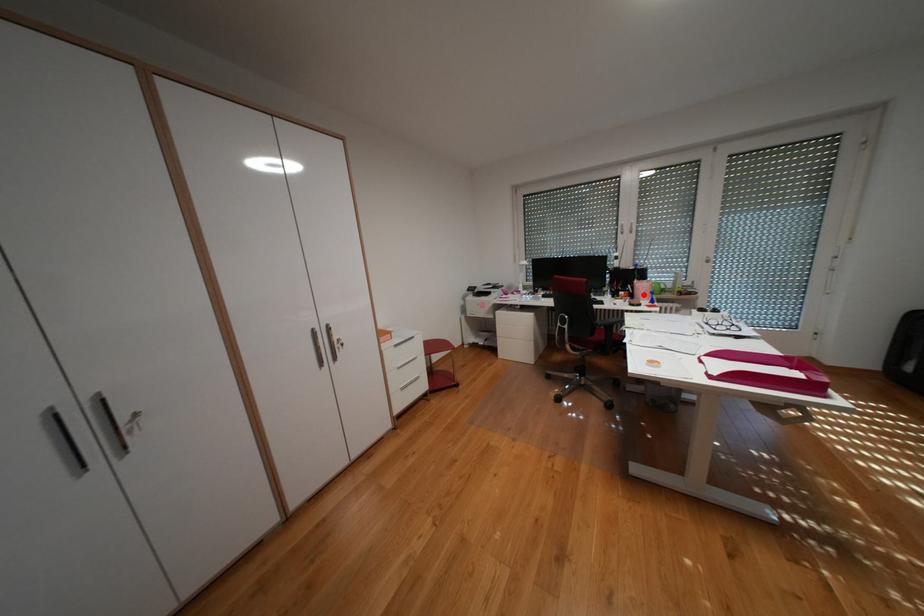
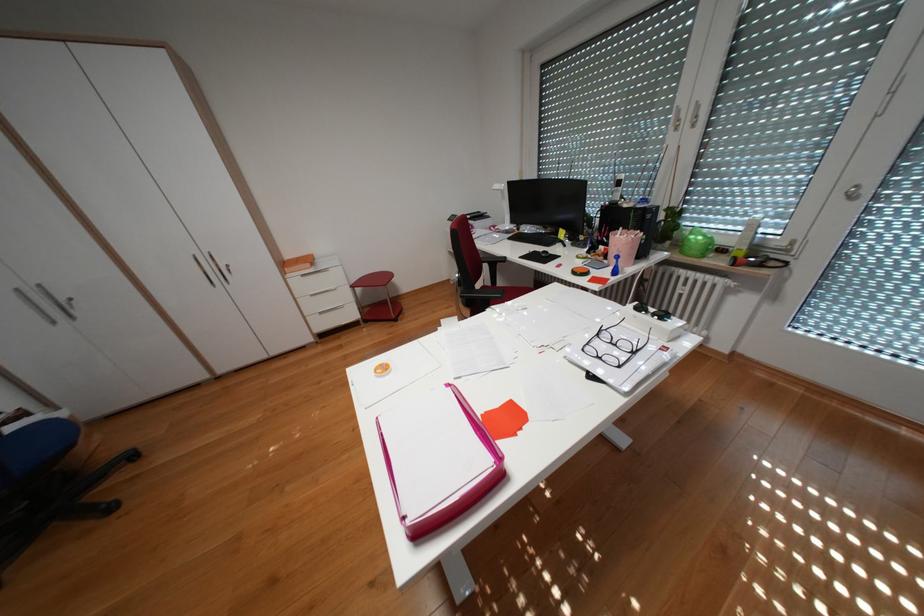
In the second image, find the point that corresponds to the highlighted location in the first image.

(618, 254)